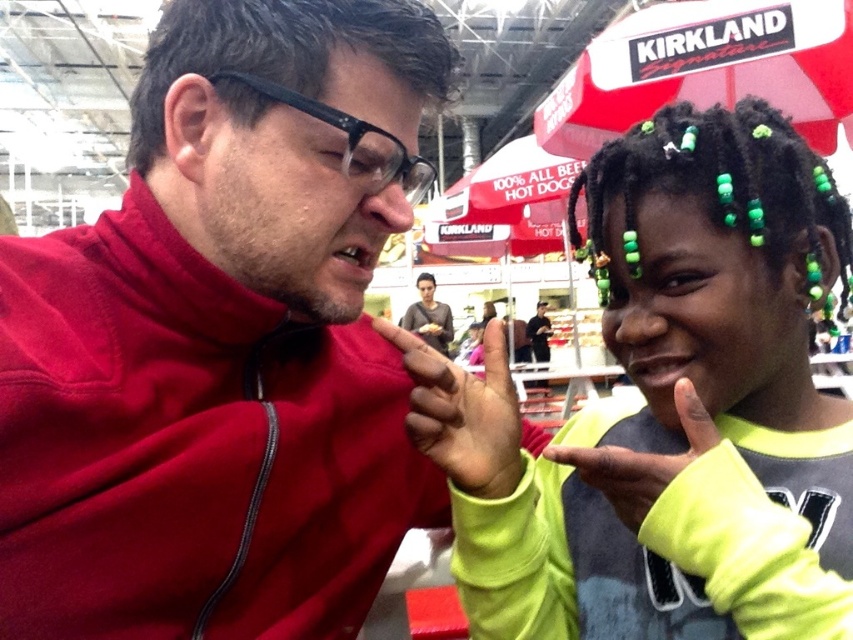
Does matte red hand at center have a lesser height compared to smooth skin face at center?

Yes.

Can you confirm if matte red hand at center is positioned to the left of smooth skin face at center?

Incorrect, matte red hand at center is not on the left side of smooth skin face at center.

Does point (518, 436) lie behind point (421, 301)?

No, (518, 436) is in front of (421, 301).

Where is `matte red hand at center`? matte red hand at center is located at coordinates (463, 412).

Can you confirm if matte red jacket at center is positioned above smooth skin face at center?

Correct, matte red jacket at center is located above smooth skin face at center.

Is point (415, 451) less distant than point (422, 296)?

Yes.

Is point (401, 20) closer to camera compared to point (437, 333)?

Yes.

Locate an element on the screen. The width and height of the screenshot is (853, 640). matte red jacket at center is located at coordinates (224, 340).

Which is in front, point (334, 534) or point (633, 502)?

Point (633, 502) is in front.

Consider the image. Can you confirm if matte red jacket at center is wider than neon green sweater at center?

Correct, the width of matte red jacket at center exceeds that of neon green sweater at center.

Image resolution: width=853 pixels, height=640 pixels. I want to click on matte red jacket at center, so click(224, 340).